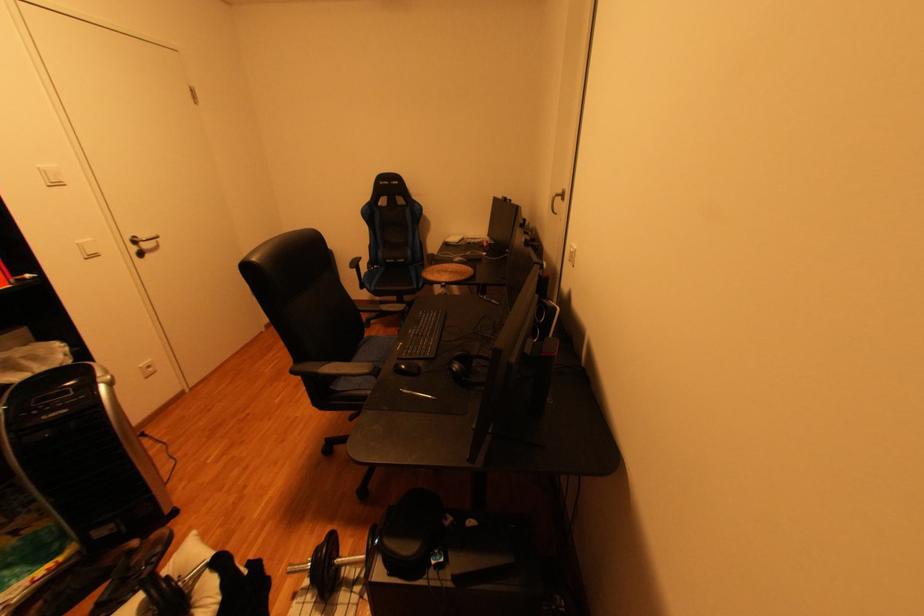
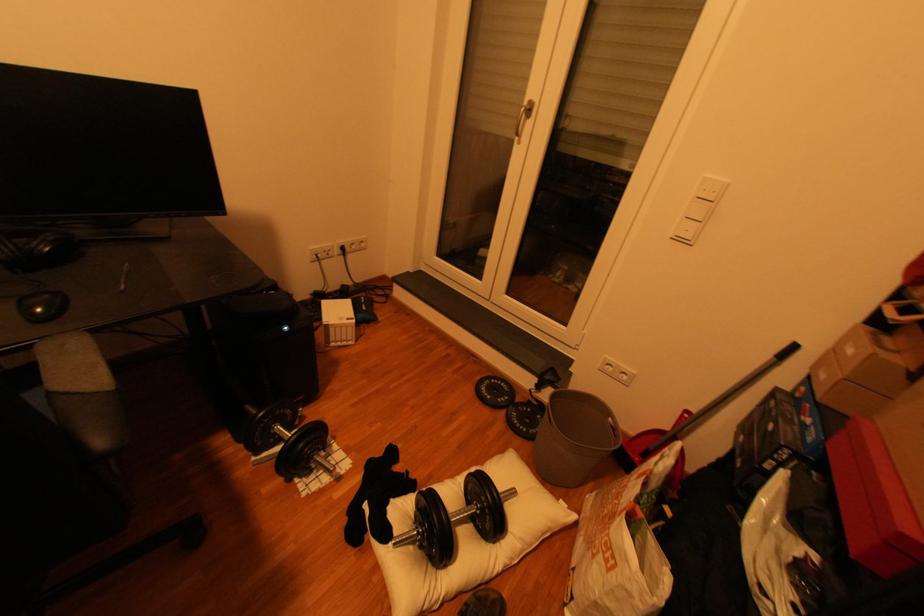
In the second image, find the point that corresponds to [215,573] in the first image.

(406, 533)